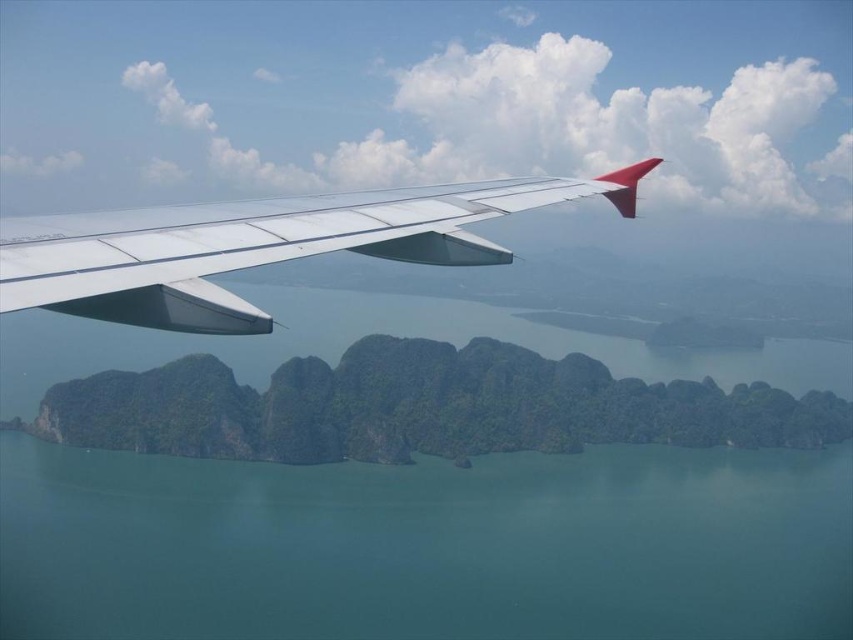
Question: Which point is farther to the camera?

Choices:
 (A) (842, 582)
 (B) (231, 221)

Answer: (A)

Question: Which of the following is the closest to the observer?

Choices:
 (A) (196, 280)
 (B) (585, 531)

Answer: (A)

Question: Is green smooth water at center positioned before metallic silver wing at upper left?

Choices:
 (A) yes
 (B) no

Answer: (B)

Question: Can you confirm if green smooth water at center is positioned to the right of metallic silver wing at upper left?

Choices:
 (A) no
 (B) yes

Answer: (A)

Question: Is green smooth water at center to the left of metallic silver wing at upper left from the viewer's perspective?

Choices:
 (A) no
 (B) yes

Answer: (B)

Question: Among these objects, which one is farthest from the camera?

Choices:
 (A) green smooth water at center
 (B) metallic silver wing at upper left

Answer: (A)